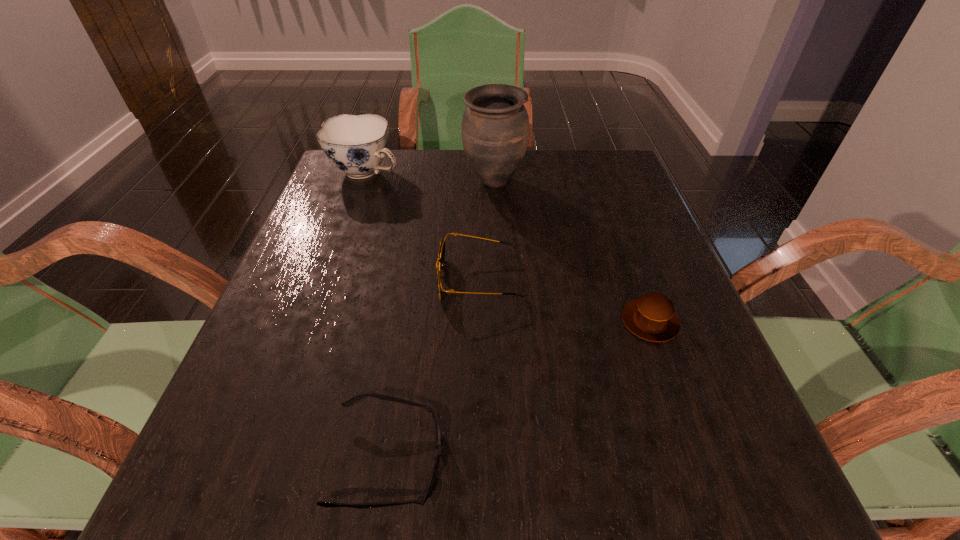
I want to click on vacant region between the second tallest object and the nearest object, so click(377, 316).

Find the location of a particular element. Image resolution: width=960 pixels, height=540 pixels. free space between the urn and the chinaware is located at coordinates pos(430,177).

Identify the location of free point between the chinaware and the farther sunglasses. This screenshot has width=960, height=540. (424, 226).

Find the location of a particular element. This screenshot has height=540, width=960. vacant space in between the nearer sunglasses and the muffin is located at coordinates (519, 390).

At what (x,y) coordinates should I click in order to perform the action: click on free space that is in between the chinaware and the nearer sunglasses. Please return your answer as a coordinate pair (x, y). This screenshot has height=540, width=960. Looking at the image, I should click on (377, 316).

Locate an element on the screen. object that is the second closest to the tallest object is located at coordinates (440, 264).

What are the coordinates of `object that ranks as the second closest to the shortest object` in the screenshot? It's located at (652, 317).

I want to click on vacant point that satisfies the following two spatial constraints: 1. on the front-facing side of the farther sunglasses; 2. on the back side of the muffin, so click(482, 321).

This screenshot has height=540, width=960. In order to click on free region that satisfies the following two spatial constraints: 1. on the front-facing side of the muffin; 2. on the left side of the taller sunglasses in this screenshot , I will do `click(482, 321)`.

Locate an element on the screen. This screenshot has width=960, height=540. vacant area that satisfies the following two spatial constraints: 1. on the front-facing side of the muffin; 2. on the right side of the farther sunglasses is located at coordinates (482, 321).